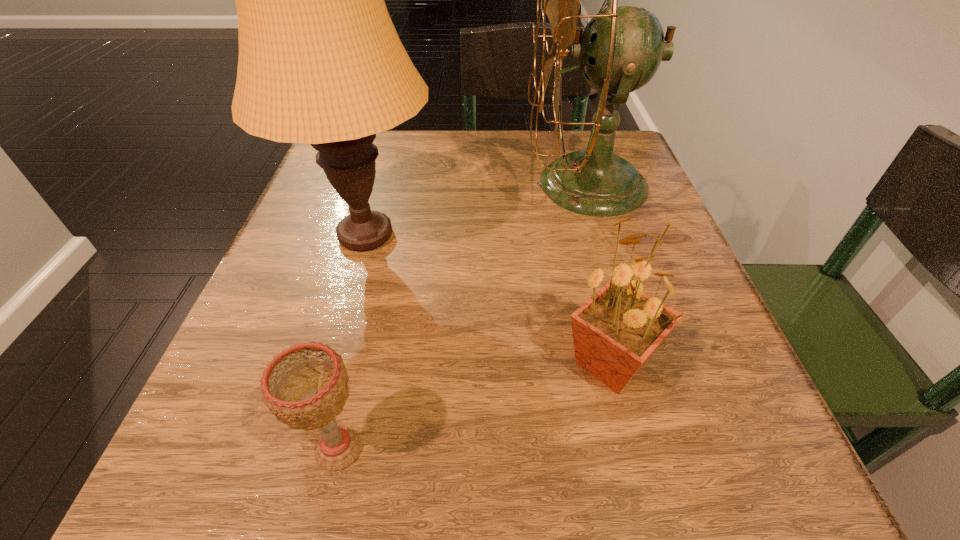
Find the location of a particular element. The width and height of the screenshot is (960, 540). object that is at the near left corner is located at coordinates (305, 386).

This screenshot has width=960, height=540. Identify the location of object present at the far right corner. (621, 48).

Locate an element on the screen. The height and width of the screenshot is (540, 960). free space at the far edge is located at coordinates (502, 185).

In the image, there is a desktop. Where is `vacant space at the near edge`? The image size is (960, 540). vacant space at the near edge is located at coordinates (384, 453).

You are a GUI agent. You are given a task and a screenshot of the screen. Output one action in this format:
    pyautogui.click(x=<x>, y=<y>)
    Task: Click on the free space at the left edge of the desktop
    This screenshot has height=540, width=960.
    Given the screenshot: What is the action you would take?
    pyautogui.click(x=319, y=328)

In the image, there is a desktop. Identify the location of blank space at the right edge. (653, 220).

Identify the location of vacant space at the near right corner. (677, 479).

At what (x,y) coordinates should I click in order to perform the action: click on unoccupied position between the lampshade and the shortest object. Please return your answer as a coordinate pair (x, y). Looking at the image, I should click on (352, 342).

Locate an element on the screen. empty location between the fan and the shortest object is located at coordinates (463, 317).

Identify the location of free area in between the lampshade and the second nearest object. The height and width of the screenshot is (540, 960). (488, 299).